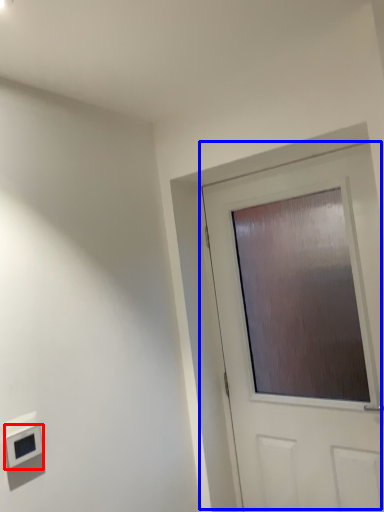
Question: Which object is closer to the camera taking this photo, light switch (highlighted by a red box) or door (highlighted by a blue box)?

Choices:
 (A) light switch
 (B) door

Answer: (A)